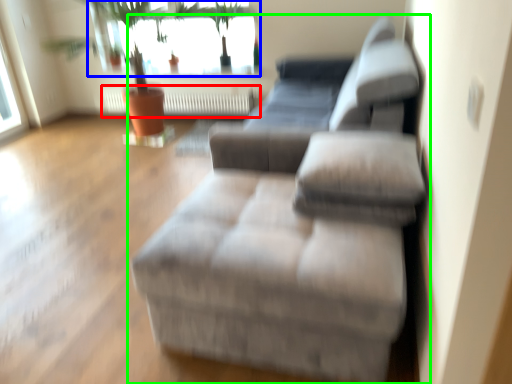
Question: Which is farther away from radiator (highlighted by a red box)? window (highlighted by a blue box) or studio couch (highlighted by a green box)?

Choices:
 (A) window
 (B) studio couch

Answer: (B)